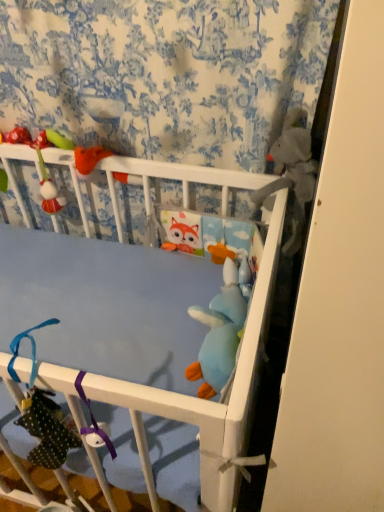
Question: Does fuzzy fabric plush at upper left, which ranks as the first toy in left-to-right order, have a lesser width compared to gray plush toy at upper right, marked as the first toy in a right-to-left arrangement?

Choices:
 (A) no
 (B) yes

Answer: (B)

Question: Is the position of fuzzy fabric plush at upper left, which ranks as the first toy in left-to-right order, less distant than that of gray plush toy at upper right, which ranks as the 4th toy in left-to-right order?

Choices:
 (A) yes
 (B) no

Answer: (B)

Question: Does fuzzy fabric plush at upper left, the fourth toy positioned from the right, turn towards gray plush toy at upper right, which ranks as the 4th toy in left-to-right order?

Choices:
 (A) yes
 (B) no

Answer: (B)

Question: Is fuzzy fabric plush at upper left, the fourth toy positioned from the right, next to gray plush toy at upper right, marked as the first toy in a right-to-left arrangement, and touching it?

Choices:
 (A) no
 (B) yes

Answer: (A)

Question: From the image's perspective, would you say fuzzy fabric plush at upper left, which ranks as the first toy in left-to-right order, is positioned over gray plush toy at upper right, which ranks as the 4th toy in left-to-right order?

Choices:
 (A) yes
 (B) no

Answer: (A)

Question: Is point (302, 159) positioned closer to the camera than point (230, 287)?

Choices:
 (A) farther
 (B) closer

Answer: (B)

Question: Would you say gray plush toy at upper right, which ranks as the 4th toy in left-to-right order, is inside or outside soft blue plush toy at center, the second toy viewed from the left?

Choices:
 (A) outside
 (B) inside

Answer: (A)

Question: Looking at their shapes, would you say gray plush toy at upper right, marked as the first toy in a right-to-left arrangement, is wider or thinner than soft blue plush toy at center, the second toy viewed from the left?

Choices:
 (A) thin
 (B) wide

Answer: (A)

Question: From the image's perspective, is gray plush toy at upper right, marked as the first toy in a right-to-left arrangement, above or below soft blue plush toy at center, the second toy viewed from the left?

Choices:
 (A) below
 (B) above

Answer: (B)

Question: Considering the relative positions of blue plush toy at center, acting as the 2th toy starting from the right, and soft blue plush toy at center, which appears as the 3th toy when viewed from the right, in the image provided, is blue plush toy at center, acting as the 2th toy starting from the right, to the left or to the right of soft blue plush toy at center, which appears as the 3th toy when viewed from the right,?

Choices:
 (A) left
 (B) right

Answer: (B)

Question: Is blue plush toy at center, acting as the 2th toy starting from the right, inside the boundaries of soft blue plush toy at center, which appears as the 3th toy when viewed from the right, or outside?

Choices:
 (A) outside
 (B) inside

Answer: (A)

Question: In terms of width, does blue plush toy at center, which is the 3th toy in left-to-right order, look wider or thinner when compared to soft blue plush toy at center, which appears as the 3th toy when viewed from the right?

Choices:
 (A) thin
 (B) wide

Answer: (A)

Question: Based on their sizes in the image, would you say blue plush toy at center, which is the 3th toy in left-to-right order, is bigger or smaller than soft blue plush toy at center, the second toy viewed from the left?

Choices:
 (A) big
 (B) small

Answer: (B)

Question: Considering the positions of fuzzy fabric plush at upper left, which ranks as the first toy in left-to-right order, and gray plush toy at upper right, marked as the first toy in a right-to-left arrangement, in the image, is fuzzy fabric plush at upper left, which ranks as the first toy in left-to-right order, wider or thinner than gray plush toy at upper right, marked as the first toy in a right-to-left arrangement,?

Choices:
 (A) wide
 (B) thin

Answer: (B)

Question: Which is correct: fuzzy fabric plush at upper left, which ranks as the first toy in left-to-right order, is inside gray plush toy at upper right, which ranks as the 4th toy in left-to-right order, or outside of it?

Choices:
 (A) inside
 (B) outside

Answer: (B)